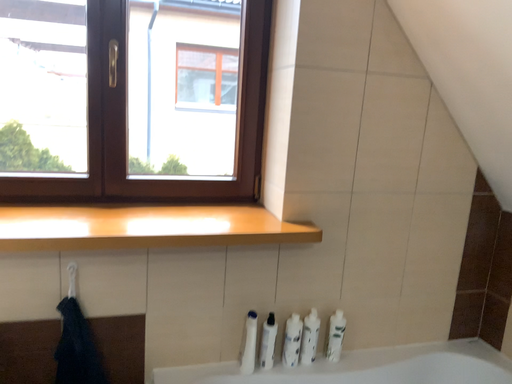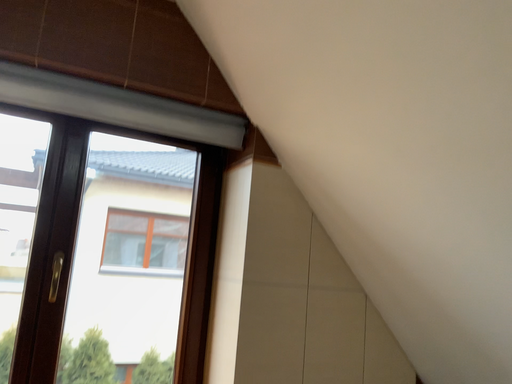
Question: How did the camera likely rotate when shooting the video?

Choices:
 (A) rotated downward
 (B) rotated upward

Answer: (B)